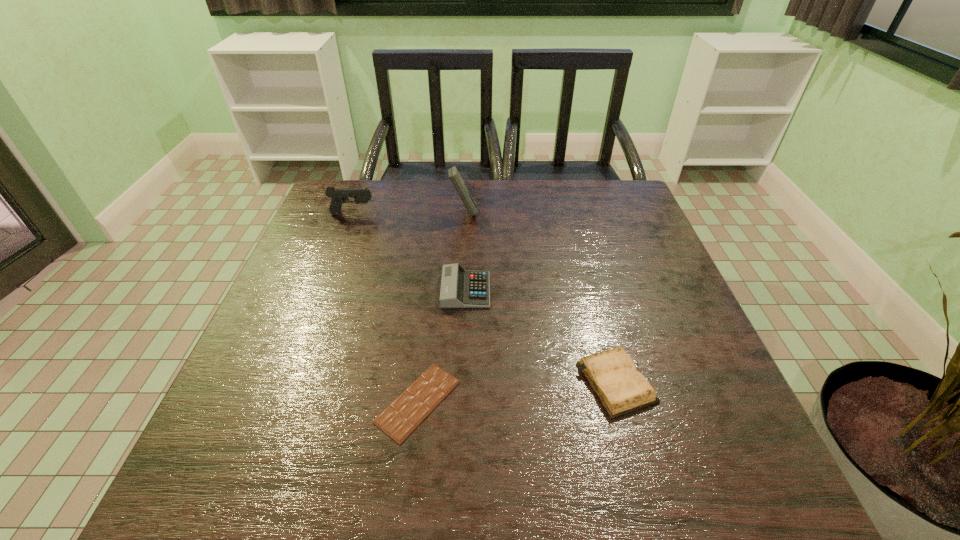
Where is `vacant region located at the barrel of the pistol`? The height and width of the screenshot is (540, 960). vacant region located at the barrel of the pistol is located at coordinates (472, 214).

What are the coordinates of `vacant space located on the right of the third farthest object` in the screenshot? It's located at (644, 290).

Where is `free location located on the back of the diary`? The width and height of the screenshot is (960, 540). free location located on the back of the diary is located at coordinates (583, 262).

Locate an element on the screen. vacant space located on the left of the chocolate bar is located at coordinates (256, 401).

The height and width of the screenshot is (540, 960). What are the coordinates of `calculator that is at the far edge` in the screenshot? It's located at (456, 179).

The width and height of the screenshot is (960, 540). In order to click on pistol located at the far edge in this screenshot , I will do `click(338, 196)`.

Where is `object present at the left edge`? The height and width of the screenshot is (540, 960). object present at the left edge is located at coordinates (338, 196).

This screenshot has height=540, width=960. I want to click on object that is at the right edge, so click(x=613, y=376).

Find the location of a particular element. The width and height of the screenshot is (960, 540). object present at the far left corner is located at coordinates (338, 196).

This screenshot has height=540, width=960. In the image, there is a desktop. In order to click on vacant area at the far edge in this screenshot , I will do `click(567, 201)`.